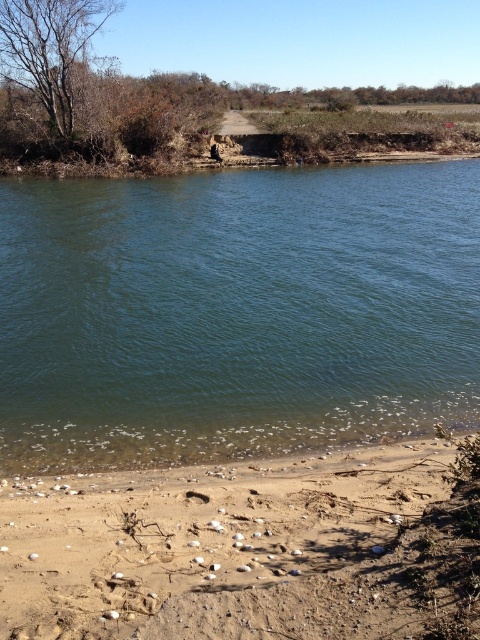
Question: Which object appears farthest from the camera in this image?

Choices:
 (A) green smooth water at center
 (B) brown sandy beach at lower right

Answer: (A)

Question: Which point is farther from the camera taking this photo?

Choices:
 (A) (266, 364)
 (B) (252, 588)

Answer: (A)

Question: Which point appears closest to the camera in this image?

Choices:
 (A) click(x=79, y=534)
 (B) click(x=176, y=288)

Answer: (A)

Question: Does green smooth water at center have a lesser width compared to brown sandy beach at lower right?

Choices:
 (A) yes
 (B) no

Answer: (B)

Question: Is green smooth water at center below brown sandy beach at lower right?

Choices:
 (A) yes
 (B) no

Answer: (B)

Question: Can you confirm if green smooth water at center is positioned to the left of brown sandy beach at lower right?

Choices:
 (A) no
 (B) yes

Answer: (B)